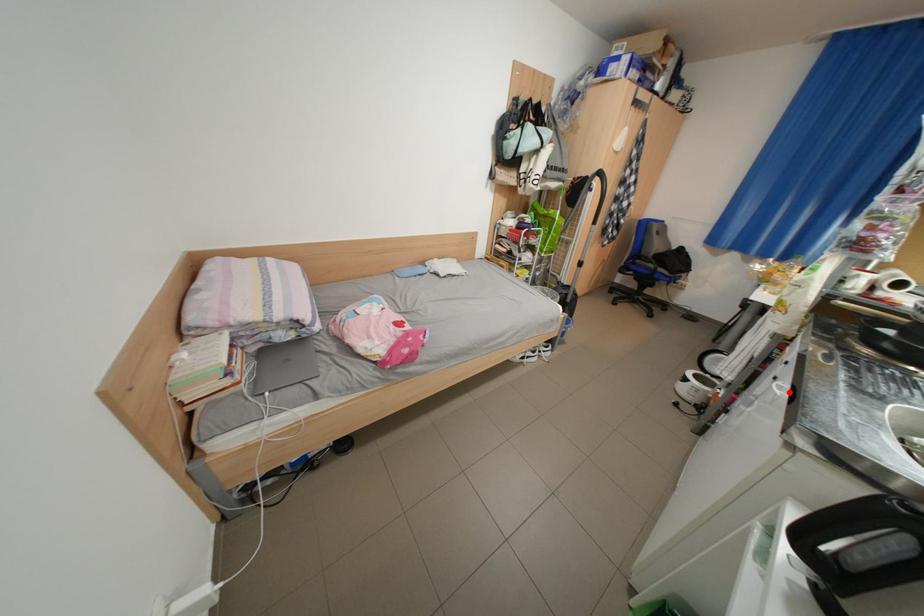
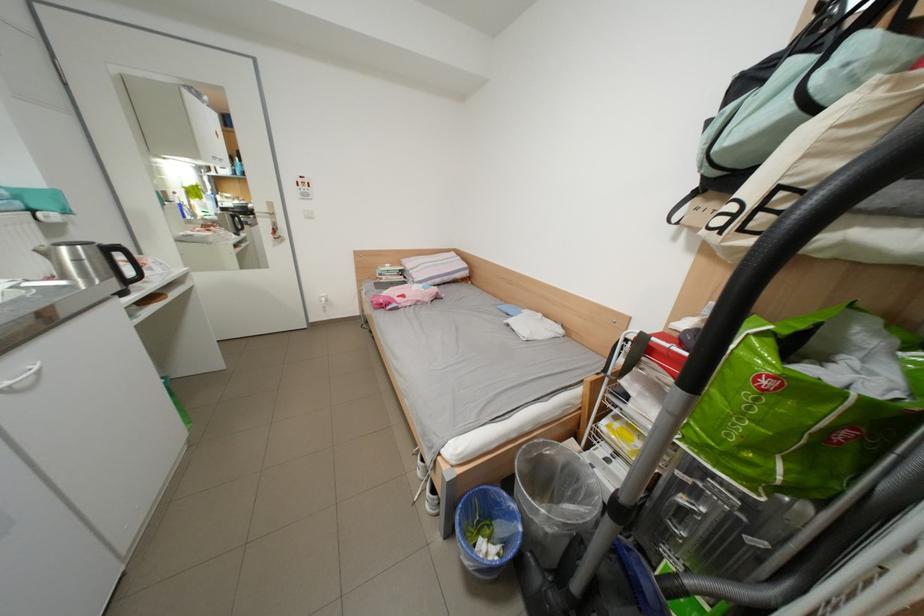
Where in the second image is the point corresponding to the highlighted location from the first image?

(46, 369)